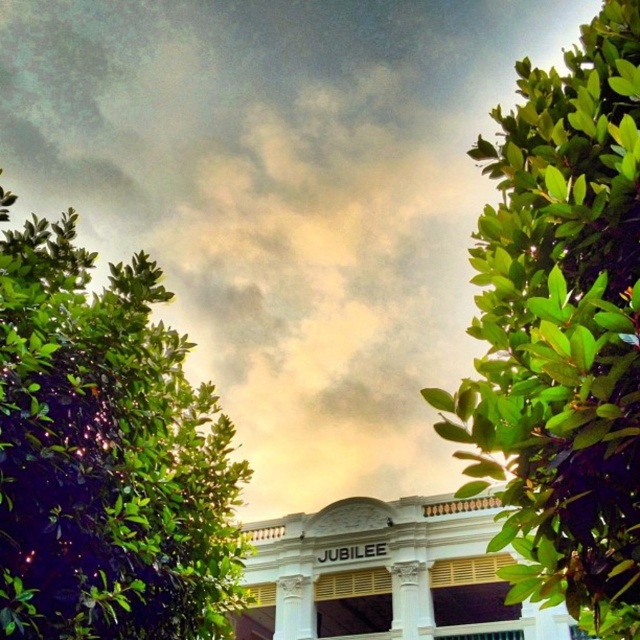
Which is more to the left, green glossy leaves at right or green leafy tree at left?

green leafy tree at left

Consider the image. Who is lower down, green glossy leaves at right or green leafy tree at left?

green leafy tree at left

Does point (593, 129) come closer to viewer compared to point (157, 358)?

Yes, it is.

Find the location of a particular element. This screenshot has height=640, width=640. green glossy leaves at right is located at coordinates (561, 332).